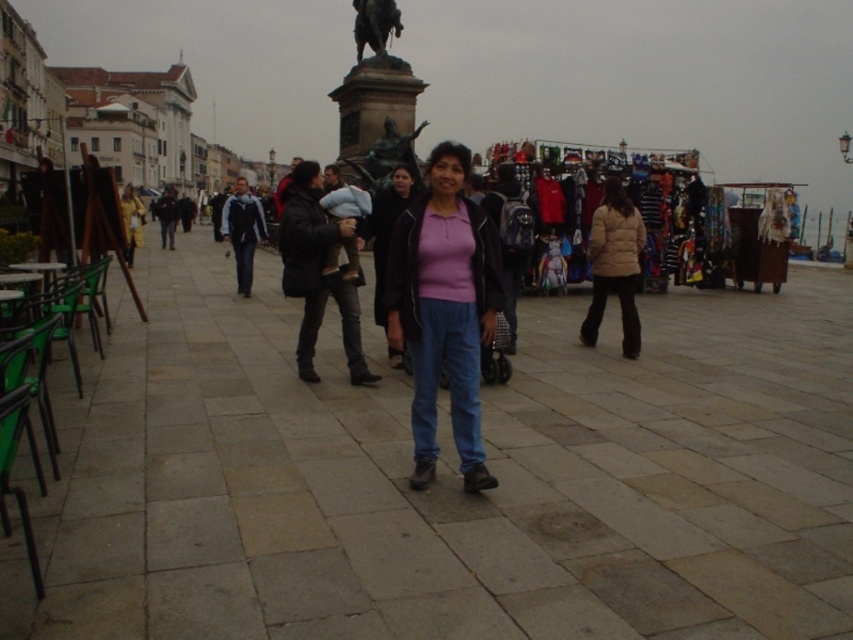
You are a photographer standing in the city square and want to capture both the beige puffy jacket at right and the bronze statue at center in your shot. Which object should you focus on first to ensure both are in frame?

You should focus on the bronze statue at center first since it is shorter than the beige puffy jacket at right, allowing you to adjust your framing to include both.

You are a tourist standing in the square and want to take a photo of the bronze statue at center without the matte pink sweater at center blocking the view. Is the statue currently visible from your position?

The matte pink sweater at center is in front of the bronze statue at center, so the statue is currently blocked by the sweater and not visible from your position.